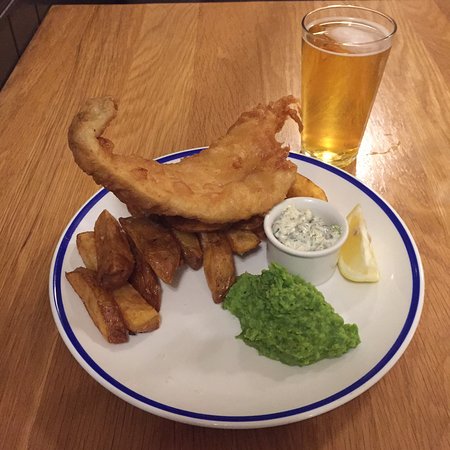
At what (x,y) coordinates should I click in order to perform the action: click on white diner plate. Please return your answer as a coordinate pair (x, y). This screenshot has width=450, height=450. Looking at the image, I should click on (240, 401).